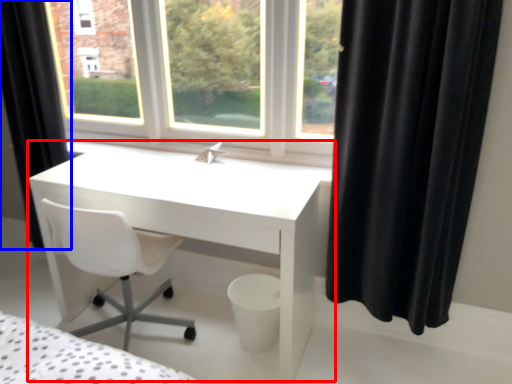
Question: Which object is closer to the camera taking this photo, table (highlighted by a red box) or curtain (highlighted by a blue box)?

Choices:
 (A) table
 (B) curtain

Answer: (A)